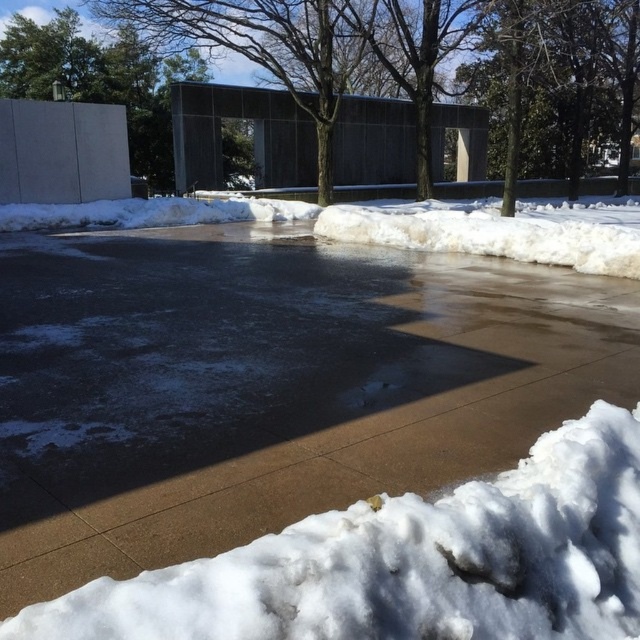
Question: Which point is farther from the camera taking this photo?

Choices:
 (A) (198, 320)
 (B) (570, 230)

Answer: (B)

Question: Which point appears farthest from the camera in this image?

Choices:
 (A) (632, 248)
 (B) (532, 413)

Answer: (A)

Question: Can you confirm if brown concrete pavement at center is smaller than white fluffy snow at center?

Choices:
 (A) no
 (B) yes

Answer: (A)

Question: Is brown concrete pavement at center wider than white fluffy snow at center?

Choices:
 (A) no
 (B) yes

Answer: (B)

Question: Which of the following is the closest to the observer?

Choices:
 (A) click(497, 202)
 (B) click(333, 480)

Answer: (B)

Question: Does brown concrete pavement at center have a larger size compared to white fluffy snow at center?

Choices:
 (A) yes
 (B) no

Answer: (A)